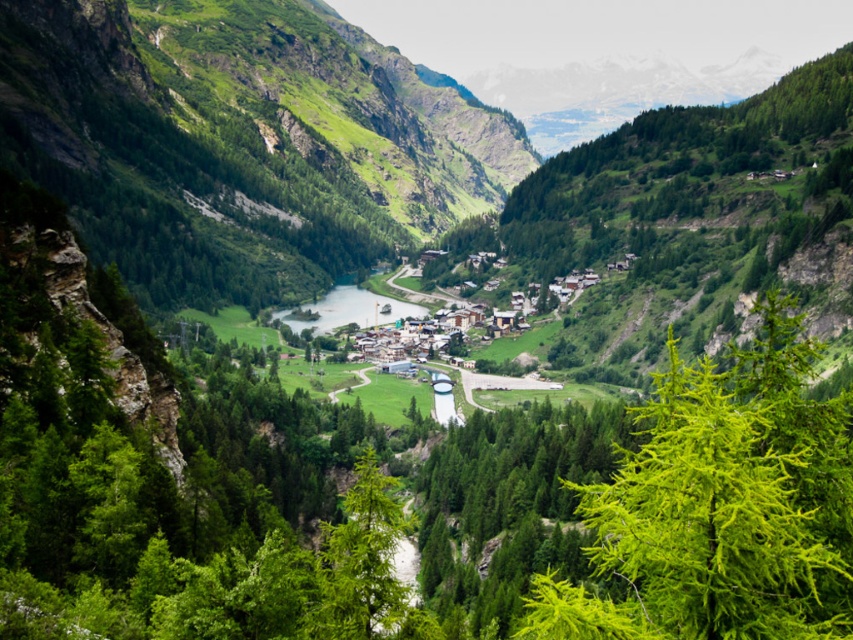
Question: Can you confirm if green needle-like at center is smaller than green grassy river at center?

Choices:
 (A) no
 (B) yes

Answer: (A)

Question: Is green needle-like at center positioned at the back of green grassy river at center?

Choices:
 (A) no
 (B) yes

Answer: (A)

Question: Among these objects, which one is nearest to the camera?

Choices:
 (A) green needle-like at center
 (B) green grassy river at center

Answer: (A)

Question: Which point is farther to the camera?

Choices:
 (A) (674, 568)
 (B) (369, 291)

Answer: (B)

Question: Can you confirm if green needle-like at center is positioned to the right of green grassy river at center?

Choices:
 (A) no
 (B) yes

Answer: (B)